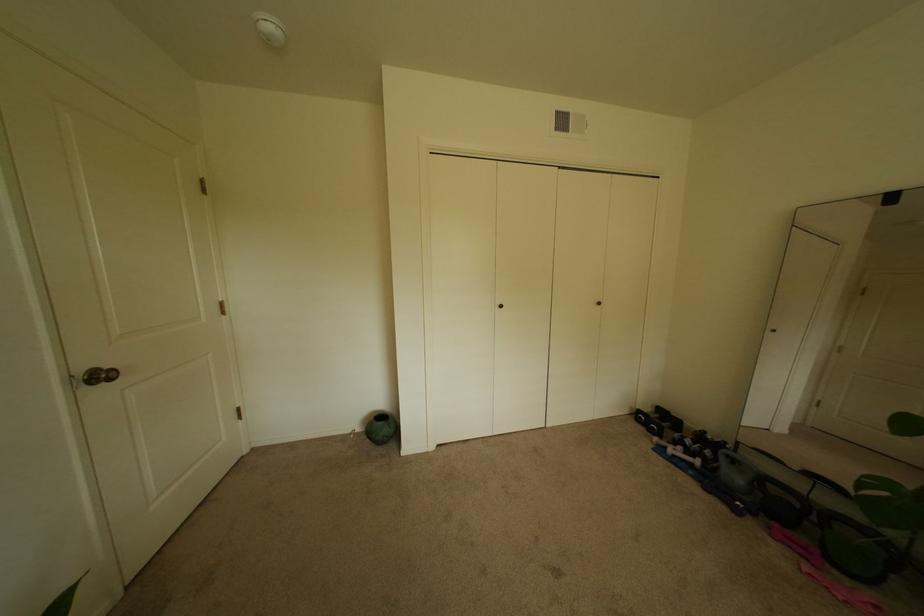
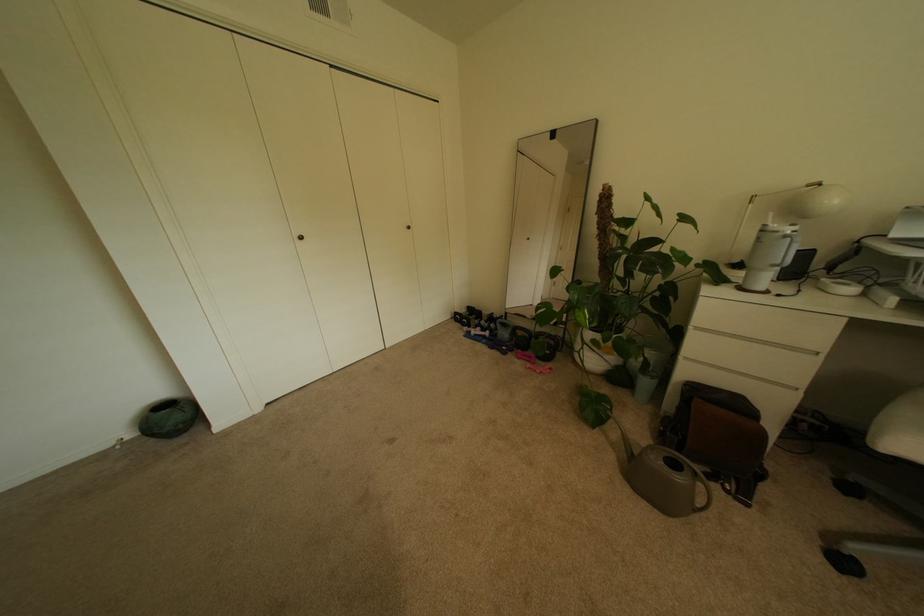
Where in the second image is the point corresponding to point (771, 516) from the first image?

(524, 350)